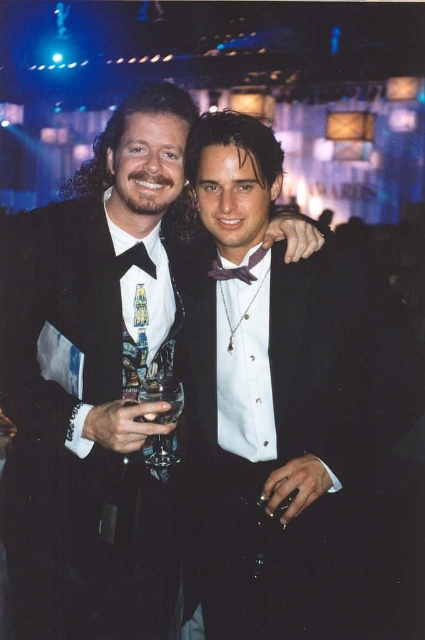
Question: Considering the real-world distances, which object is closest to the purple satin bow tie at center?

Choices:
 (A) matte black tuxedo at center
 (B) black satin bow tie at left

Answer: (B)

Question: Based on their relative distances, which object is nearer to the matte black tuxedo at center?

Choices:
 (A) black satin tuxedo at center
 (B) black satin bow tie at left

Answer: (A)

Question: Can you confirm if black satin tuxedo at center is bigger than black satin bow tie at left?

Choices:
 (A) no
 (B) yes

Answer: (B)

Question: Is black satin tuxedo at center closer to camera compared to black satin bow tie at left?

Choices:
 (A) yes
 (B) no

Answer: (A)

Question: Considering the relative positions of matte black tuxedo at center and black satin bow tie at left in the image provided, where is matte black tuxedo at center located with respect to black satin bow tie at left?

Choices:
 (A) above
 (B) below

Answer: (B)

Question: Which of these objects is positioned farthest from the black satin tuxedo at center?

Choices:
 (A) purple satin bow tie at center
 (B) matte black tuxedo at center

Answer: (A)